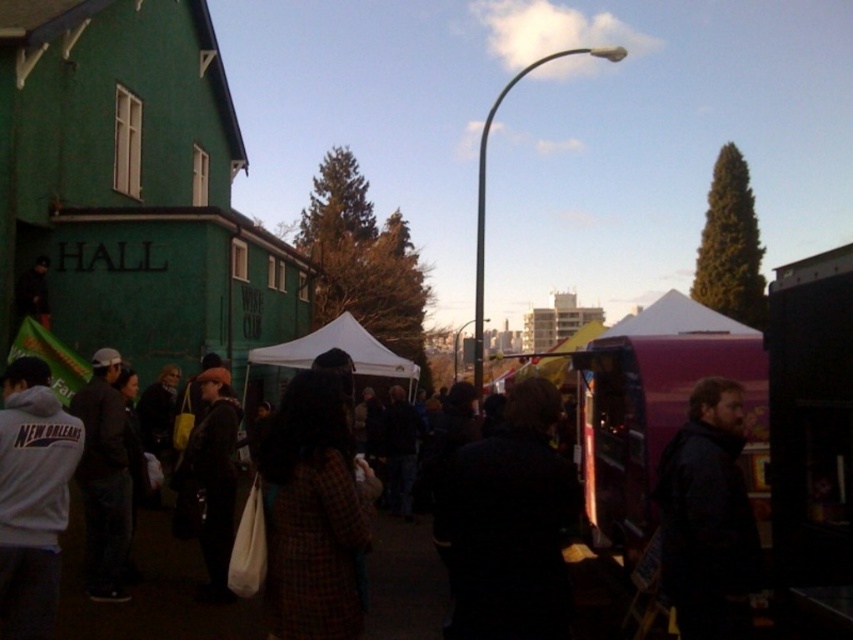
Between white fleece jacket at lower left and matte black jacket at center, which one appears on the left side from the viewer's perspective?

Answer: From the viewer's perspective, white fleece jacket at lower left appears more on the left side.

Between white fleece jacket at lower left and matte black jacket at center, which one has less height?

Standing shorter between the two is white fleece jacket at lower left.

In order to click on white fleece jacket at lower left in this screenshot , I will do `click(32, 497)`.

In order to click on white fleece jacket at lower left in this screenshot , I will do `click(32, 497)`.

Does dark gray jacket at left appear over matte black jacket at center?

Indeed, dark gray jacket at left is positioned over matte black jacket at center.

Is point (102, 580) positioned behind point (196, 467)?

No.

Locate an element on the screen. The width and height of the screenshot is (853, 640). dark gray jacket at left is located at coordinates (103, 477).

Describe the element at coordinates (149, 592) in the screenshot. I see `dark brown fabric crowd at center` at that location.

Who is taller, dark brown fabric crowd at center or matte black jacket at center?

With more height is matte black jacket at center.

Between point (115, 621) and point (230, 520), which one is positioned behind?

The point (230, 520) is more distant.

Where is `dark brown fabric crowd at center`? The height and width of the screenshot is (640, 853). dark brown fabric crowd at center is located at coordinates click(149, 592).